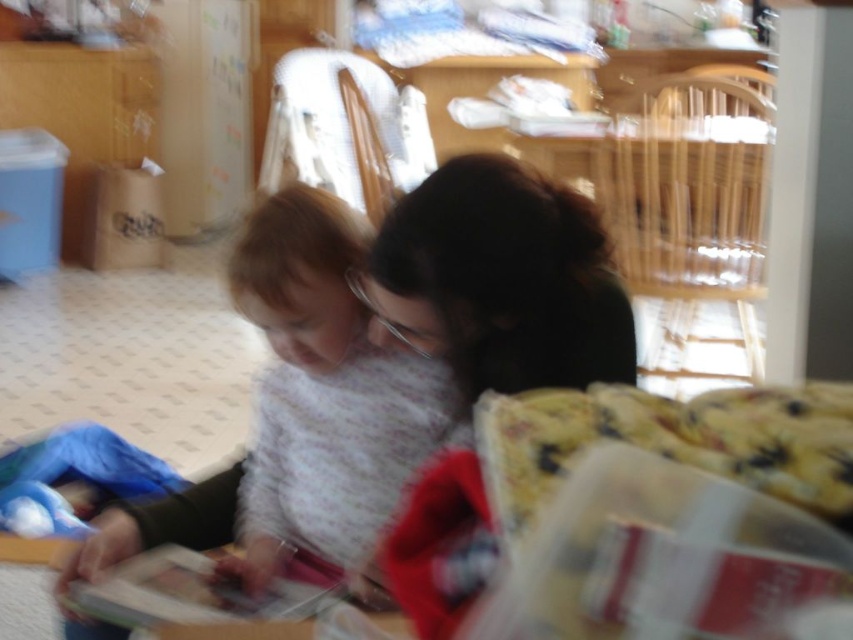
Question: Observing the image, what is the correct spatial positioning of fluffy white sweater at center in reference to dark green sweater at center?

Choices:
 (A) above
 (B) below

Answer: (B)

Question: Is fluffy white sweater at center to the left of dark green sweater at center from the viewer's perspective?

Choices:
 (A) yes
 (B) no

Answer: (A)

Question: Is fluffy white sweater at center positioned behind dark green sweater at center?

Choices:
 (A) yes
 (B) no

Answer: (A)

Question: Which of the following is the farthest from the observer?

Choices:
 (A) dark green sweater at center
 (B) fluffy white sweater at center

Answer: (B)